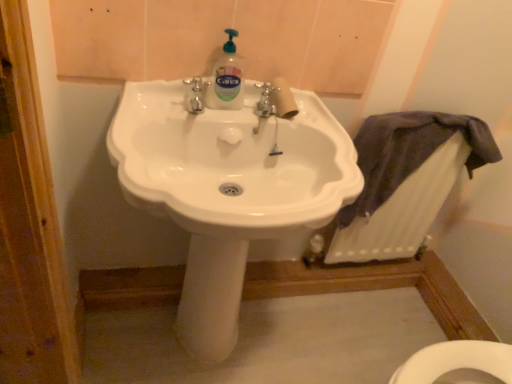
Where is `vacant space underneath white textured radiator at lower right (from a real-world perspective)`? Image resolution: width=512 pixels, height=384 pixels. vacant space underneath white textured radiator at lower right (from a real-world perspective) is located at coordinates (365, 264).